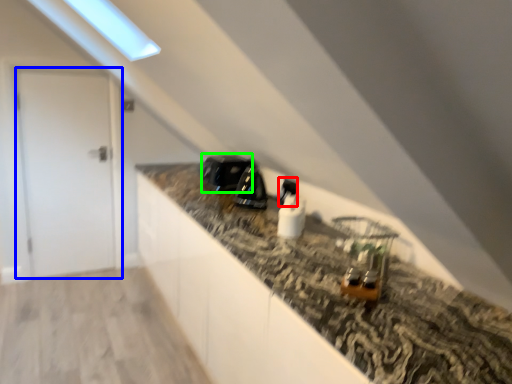
Question: Considering the real-world distances, which object is closest to appliance (highlighted by a red box)? door (highlighted by a blue box) or appliance (highlighted by a green box).

Choices:
 (A) door
 (B) appliance

Answer: (B)